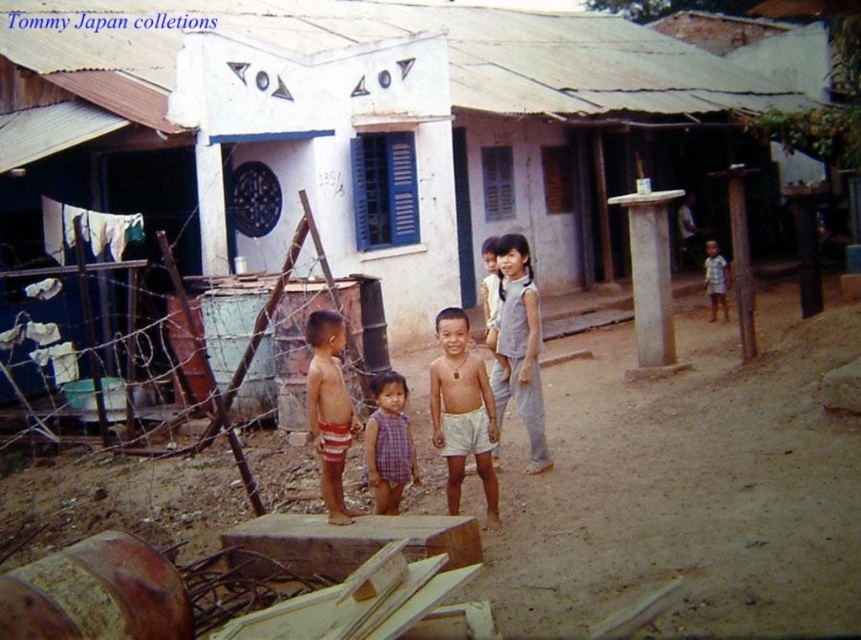
Question: Based on their relative distances, which object is nearer to the white cotton shorts at center?

Choices:
 (A) brown sandy ground at center
 (B) reddish-brown shorts at center
 (C) gray cotton dress at center
 (D) plaid fabric dress at center

Answer: (D)

Question: Does white cotton shorts at center have a lesser width compared to plaid fabric dress at center?

Choices:
 (A) yes
 (B) no

Answer: (B)

Question: Is gray cotton dress at center positioned before reddish-brown shorts at center?

Choices:
 (A) no
 (B) yes

Answer: (A)

Question: Among these points, which one is farthest from the camera?

Choices:
 (A) (314, 362)
 (B) (821, 520)
 (C) (139, 29)
 (D) (711, 240)

Answer: (D)

Question: Which point is closer to the camera taking this photo?

Choices:
 (A) (90, 524)
 (B) (722, 316)

Answer: (A)

Question: Does white cotton shorts at center come behind reddish-brown shorts at center?

Choices:
 (A) no
 (B) yes

Answer: (B)